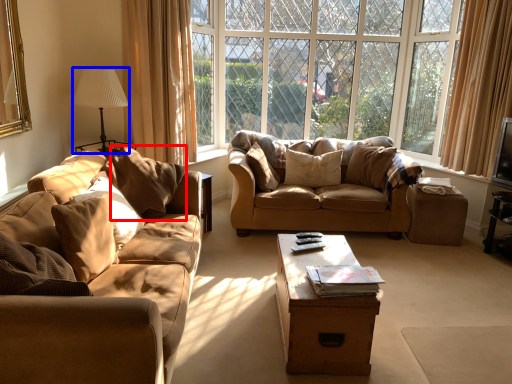
Question: Which object appears farthest to the camera in this image, pillow (highlighted by a red box) or lamp (highlighted by a blue box)?

Choices:
 (A) pillow
 (B) lamp

Answer: (B)